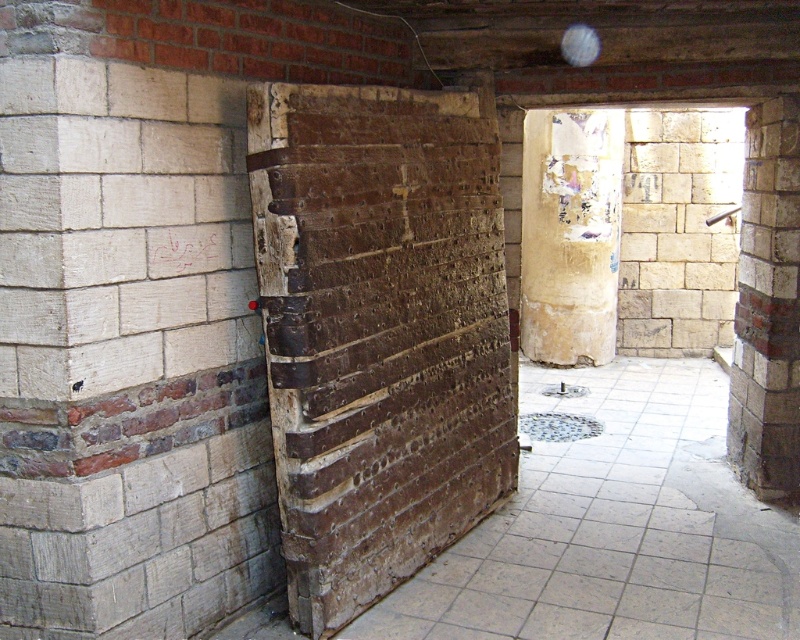
Question: Does weathered brown brick at center appear on the right side of white brick pillar at center?

Choices:
 (A) yes
 (B) no

Answer: (B)

Question: Among these points, which one is farthest from the camera?

Choices:
 (A) (762, 116)
 (B) (558, 173)
 (C) (652, 225)
 (D) (372, 488)

Answer: (C)

Question: Which of the following is the closest to the observer?

Choices:
 (A) [654, 125]
 (B) [754, 256]
 (C) [314, 177]
 (D) [612, 200]

Answer: (C)

Question: Which point appears farthest from the camera in this image?

Choices:
 (A) (610, 301)
 (B) (722, 129)

Answer: (A)

Question: Is light beige stone wall at right wider than white brick pillar at center?

Choices:
 (A) no
 (B) yes

Answer: (B)

Question: Does weathered brown brick at center have a smaller size compared to light beige stone wall at right?

Choices:
 (A) no
 (B) yes

Answer: (A)